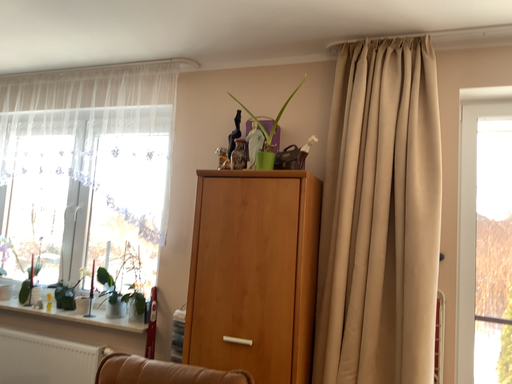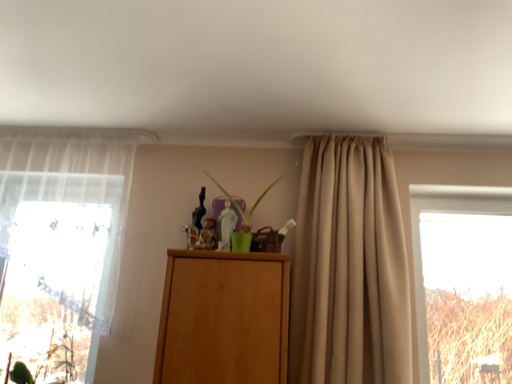
Question: How did the camera likely rotate when shooting the video?

Choices:
 (A) rotated upward
 (B) rotated downward

Answer: (A)